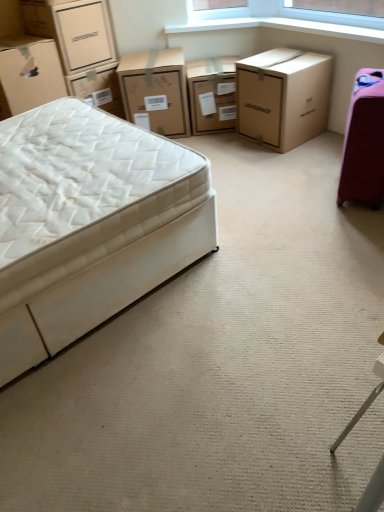
Where is `vacant space situated above brown cardboard box at upper right, which is the 3th chest of drawers in left-to-right order (from a real-world perspective)`? This screenshot has width=384, height=512. vacant space situated above brown cardboard box at upper right, which is the 3th chest of drawers in left-to-right order (from a real-world perspective) is located at coordinates tap(281, 60).